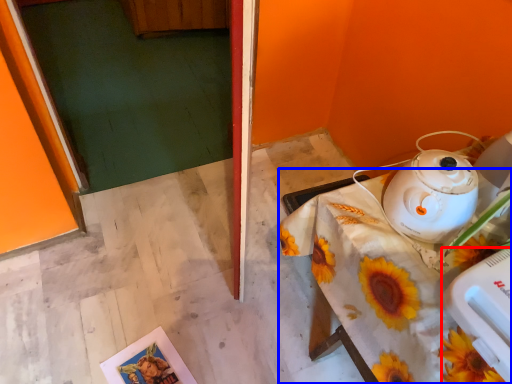
Question: Which object appears closest to the camera in this image, appliance (highlighted by a red box) or table (highlighted by a blue box)?

Choices:
 (A) appliance
 (B) table

Answer: (A)